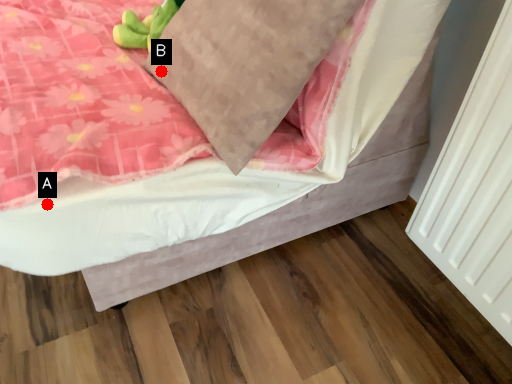
Question: Two points are circled on the image, labeled by A and B beside each circle. Which point is further to the camera?

Choices:
 (A) A is further
 (B) B is further

Answer: (B)